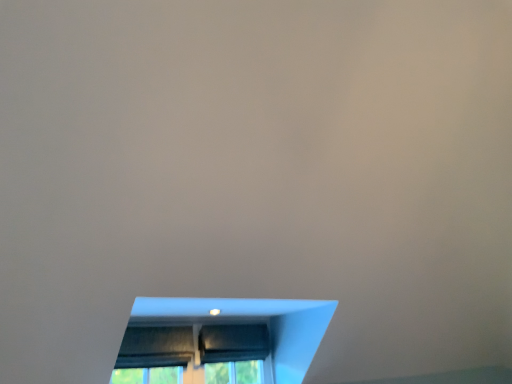
Image resolution: width=512 pixels, height=384 pixels. What do you see at coordinates (233, 343) in the screenshot?
I see `black matte curtain at center` at bounding box center [233, 343].

I want to click on black matte curtain at center, so click(x=233, y=343).

Identify the location of black matte curtain at center. (233, 343).